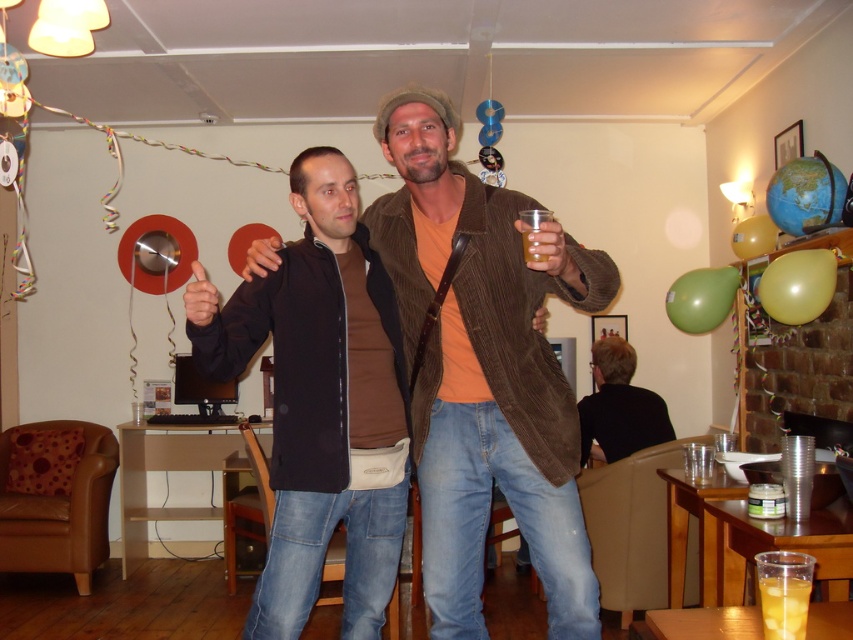
Is point (795, 204) positioned after point (787, 636)?

Yes.

In the scene shown: Can you confirm if light yellow balloon at upper right is positioned above translucent plastic cup at lower right?

Yes.

Between point (804, 168) and point (791, 627), which one is positioned behind?

Point (804, 168)

Where is `light yellow balloon at upper right`? light yellow balloon at upper right is located at coordinates pos(805,195).

Measure the distance between light yellow rubber balloon at upper right and rubber yellow balloon at upper right.

A distance of 29.88 inches exists between light yellow rubber balloon at upper right and rubber yellow balloon at upper right.

Between light yellow rubber balloon at upper right and rubber yellow balloon at upper right, which one appears on the right side from the viewer's perspective?

rubber yellow balloon at upper right is more to the right.

Measure the distance between light yellow rubber balloon at upper right and camera.

light yellow rubber balloon at upper right and camera are 2.86 meters apart from each other.

Where is `light yellow rubber balloon at upper right`? light yellow rubber balloon at upper right is located at coordinates (798, 285).

Can you confirm if light yellow balloon at upper right is taller than green matte balloon at upper right?

Yes, light yellow balloon at upper right is taller than green matte balloon at upper right.

Is light yellow balloon at upper right wider than green matte balloon at upper right?

No, light yellow balloon at upper right is not wider than green matte balloon at upper right.

Find the location of a particular element. Image resolution: width=853 pixels, height=640 pixels. light yellow balloon at upper right is located at coordinates (805, 195).